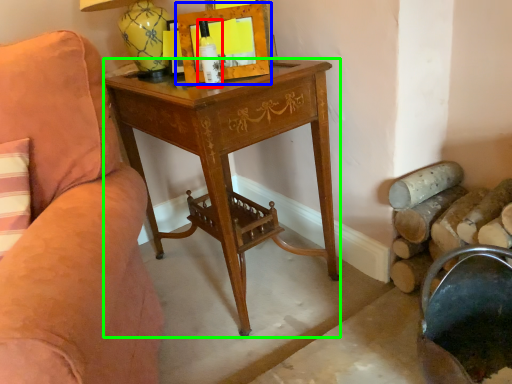
Question: Which object is the farthest from bottle (highlighted by a red box)? Choose among these: picture frame (highlighted by a blue box) or desk (highlighted by a green box).

Choices:
 (A) picture frame
 (B) desk

Answer: (B)